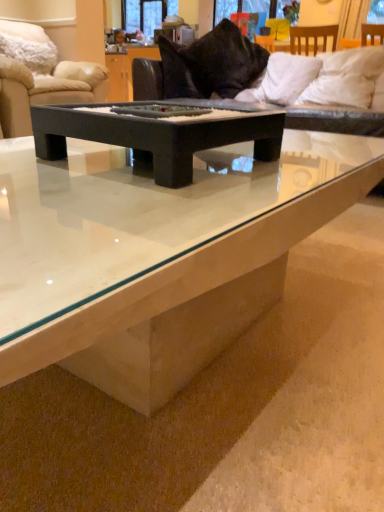
Question: From a real-world perspective, is velvet black couch at upper center, which ranks as the first studio couch in right-to-left order, physically below white soft pillow at upper right, which ranks as the fourth pillow in left-to-right order?

Choices:
 (A) yes
 (B) no

Answer: (A)

Question: Considering the relative sizes of velvet black couch at upper center, which appears as the second studio couch when viewed from the left, and white soft pillow at upper right, which ranks as the fourth pillow in left-to-right order, in the image provided, is velvet black couch at upper center, which appears as the second studio couch when viewed from the left, smaller than white soft pillow at upper right, which ranks as the fourth pillow in left-to-right order,?

Choices:
 (A) no
 (B) yes

Answer: (A)

Question: Is velvet black couch at upper center, which ranks as the first studio couch in right-to-left order, thinner than white soft pillow at upper right, which ranks as the fourth pillow in left-to-right order?

Choices:
 (A) no
 (B) yes

Answer: (A)

Question: Is velvet black couch at upper center, which appears as the second studio couch when viewed from the left, beside white soft pillow at upper right, which appears as the first pillow when viewed from the right?

Choices:
 (A) yes
 (B) no

Answer: (B)

Question: Is velvet black couch at upper center, which appears as the second studio couch when viewed from the left, far from white soft pillow at upper right, which appears as the first pillow when viewed from the right?

Choices:
 (A) no
 (B) yes

Answer: (A)

Question: Is velvet black couch at upper center, which appears as the second studio couch when viewed from the left, aimed at white soft pillow at upper right, which ranks as the fourth pillow in left-to-right order?

Choices:
 (A) yes
 (B) no

Answer: (A)

Question: Can you confirm if white fluffy pillow at upper left, the 1th pillow positioned from the left, is smaller than velvet black couch at upper center, which ranks as the first studio couch in right-to-left order?

Choices:
 (A) no
 (B) yes

Answer: (B)

Question: Is white fluffy pillow at upper left, the 1th pillow positioned from the left, outside velvet black couch at upper center, which ranks as the first studio couch in right-to-left order?

Choices:
 (A) yes
 (B) no

Answer: (A)

Question: Is white fluffy pillow at upper left, placed as the fourth pillow when sorted from right to left, far away from velvet black couch at upper center, which appears as the second studio couch when viewed from the left?

Choices:
 (A) no
 (B) yes

Answer: (B)

Question: Is white fluffy pillow at upper left, the 1th pillow positioned from the left, aimed at velvet black couch at upper center, which ranks as the first studio couch in right-to-left order?

Choices:
 (A) no
 (B) yes

Answer: (B)

Question: Does white fluffy pillow at upper left, placed as the fourth pillow when sorted from right to left, contain velvet black couch at upper center, which appears as the second studio couch when viewed from the left?

Choices:
 (A) yes
 (B) no

Answer: (B)

Question: Can you confirm if white fluffy pillow at upper left, placed as the fourth pillow when sorted from right to left, is shorter than velvet black couch at upper center, which appears as the second studio couch when viewed from the left?

Choices:
 (A) no
 (B) yes

Answer: (B)

Question: Is white soft pillow at upper right, which appears as the first pillow when viewed from the right, oriented away from black matte tray at center, the 1th coffee table positioned from the top?

Choices:
 (A) no
 (B) yes

Answer: (A)